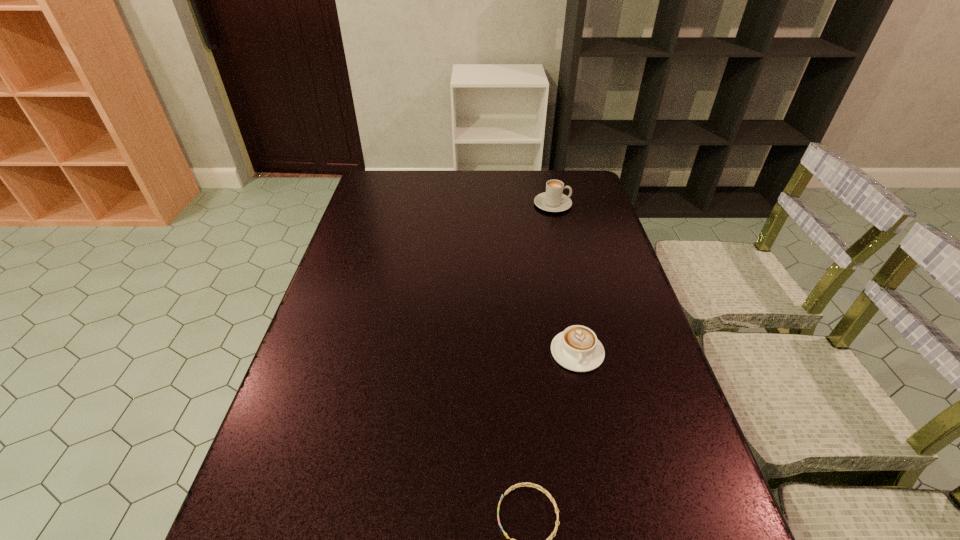
At what (x,y) coordinates should I click in order to perform the action: click on the taller cappuccino. Please return your answer as a coordinate pair (x, y). The width and height of the screenshot is (960, 540). Looking at the image, I should click on (552, 200).

The height and width of the screenshot is (540, 960). Find the location of `the farther cappuccino`. the farther cappuccino is located at coordinates (552, 200).

At what (x,y) coordinates should I click in order to perform the action: click on the second nearest object. Please return your answer as a coordinate pair (x, y). This screenshot has width=960, height=540. Looking at the image, I should click on (577, 348).

Identify the location of the second shortest object. The height and width of the screenshot is (540, 960). (577, 348).

Locate an element on the screen. This screenshot has width=960, height=540. vacant region located to the right of the farthest object is located at coordinates (588, 204).

Locate an element on the screen. free space located with the handle on the right side of the second farthest object is located at coordinates (594, 432).

Where is `object located in the far edge section of the desktop`? Image resolution: width=960 pixels, height=540 pixels. object located in the far edge section of the desktop is located at coordinates (552, 200).

Image resolution: width=960 pixels, height=540 pixels. What are the coordinates of `object at the far right corner` in the screenshot? It's located at (552, 200).

What are the coordinates of `free spot at the far edge of the desktop` in the screenshot? It's located at click(533, 181).

Image resolution: width=960 pixels, height=540 pixels. In the image, there is a desktop. Identify the location of vacant space at the left edge. click(351, 357).